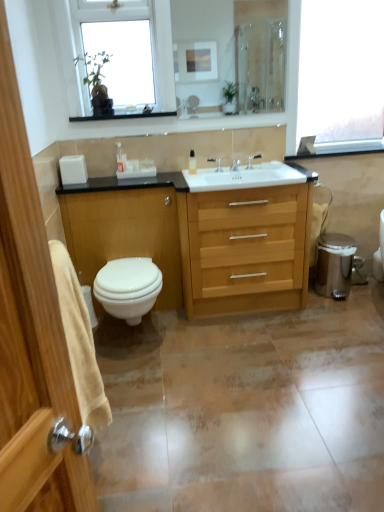
Question: Is transparent glass window at upper right, the 2th window when ordered from left to right, oriented towards white glossy toilet at lower left?

Choices:
 (A) yes
 (B) no

Answer: (B)

Question: Does transparent glass window at upper right, the 2th window when ordered from left to right, have a smaller size compared to white glossy toilet at lower left?

Choices:
 (A) yes
 (B) no

Answer: (B)

Question: Is transparent glass window at upper right, which is counted as the 1th window, starting from the right, shorter than white glossy toilet at lower left?

Choices:
 (A) yes
 (B) no

Answer: (B)

Question: Is transparent glass window at upper right, which is counted as the 1th window, starting from the right, thinner than white glossy toilet at lower left?

Choices:
 (A) yes
 (B) no

Answer: (A)

Question: From a real-world perspective, is transparent glass window at upper right, which is counted as the 1th window, starting from the right, on top of white glossy toilet at lower left?

Choices:
 (A) no
 (B) yes

Answer: (B)

Question: In terms of width, does white glossy toilet at lower left look wider or thinner when compared to white glossy lotion at center, which is the 2th toiletry in right-to-left order?

Choices:
 (A) thin
 (B) wide

Answer: (B)

Question: Is point (122, 305) closer or farther from the camera than point (122, 154)?

Choices:
 (A) closer
 (B) farther

Answer: (A)

Question: Is white glossy toilet at lower left situated inside white glossy lotion at center, which is the second toiletry from left to right, or outside?

Choices:
 (A) inside
 (B) outside

Answer: (B)

Question: Is white glossy toilet at lower left in front of or behind white glossy lotion at center, which is the second toiletry from left to right, in the image?

Choices:
 (A) behind
 (B) front

Answer: (B)

Question: Is white matte toilet paper at right bigger or smaller than matte silver faucet at center, the second tap in the left-to-right sequence?

Choices:
 (A) big
 (B) small

Answer: (A)

Question: In the image, is white matte toilet paper at right positioned in front of or behind matte silver faucet at center, the second tap in the left-to-right sequence?

Choices:
 (A) front
 (B) behind

Answer: (B)

Question: Considering the positions of point (317, 232) and point (249, 159), is point (317, 232) closer or farther from the camera than point (249, 159)?

Choices:
 (A) closer
 (B) farther

Answer: (B)

Question: From a real-world perspective, is white matte toilet paper at right physically located above or below matte silver faucet at center, the first tap positioned from the right?

Choices:
 (A) below
 (B) above

Answer: (A)

Question: From a real-world perspective, is white glossy lotion at center, which is the 2th toiletry in right-to-left order, positioned above or below white matte toilet paper at right?

Choices:
 (A) below
 (B) above

Answer: (B)

Question: Is point (122, 162) positioned closer to the camera than point (319, 221)?

Choices:
 (A) closer
 (B) farther

Answer: (A)